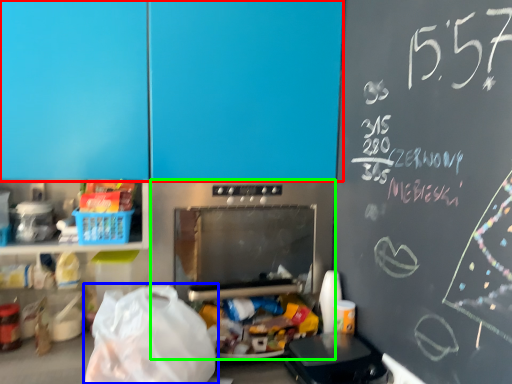
Question: Based on their relative distances, which object is farther from leftover (highlighted by a red box)? Choose from grocery bag (highlighted by a blue box) and appliance (highlighted by a green box).

Choices:
 (A) grocery bag
 (B) appliance

Answer: (A)